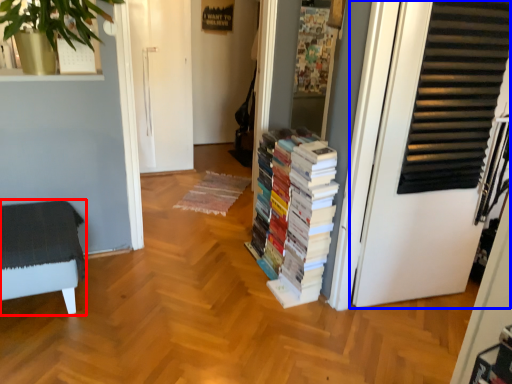
Question: Which of the following is the farthest to the observer, furniture (highlighted by a red box) or door (highlighted by a blue box)?

Choices:
 (A) furniture
 (B) door

Answer: (A)